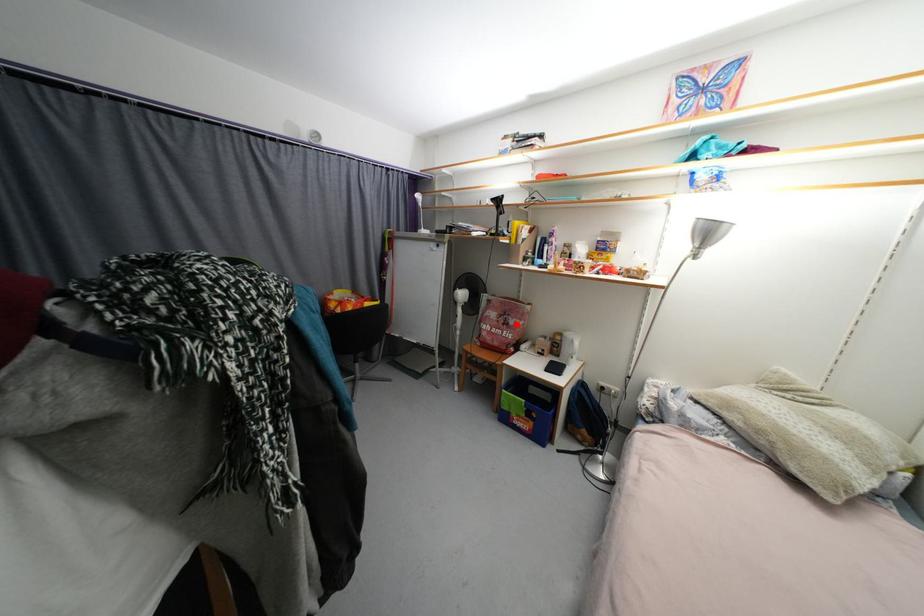
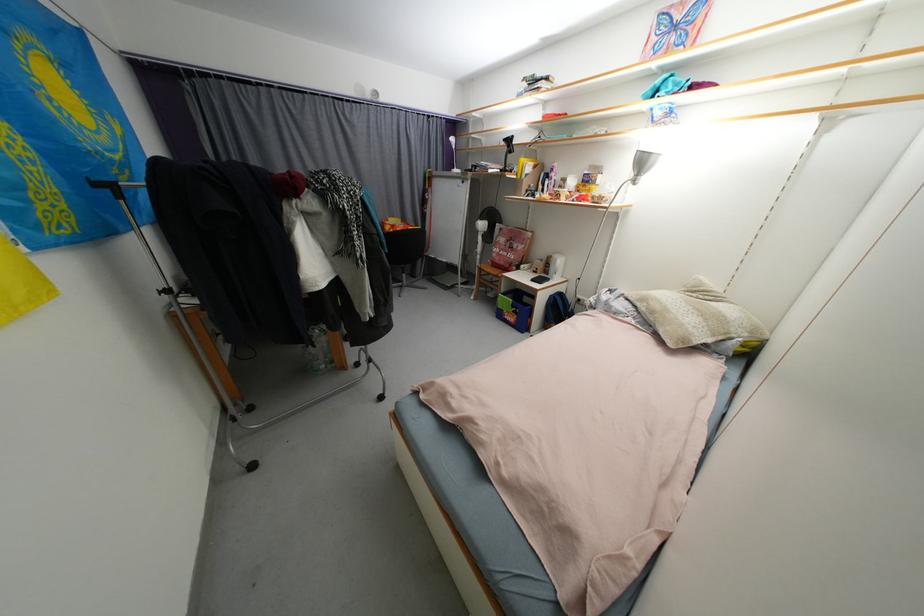
Question: A red point is marked in image1. In image2, is the corresponding 3D point closer to the camera or farther? Reply with the corresponding letter.

Choices:
 (A) The corresponding 3D point is closer.
 (B) The corresponding 3D point is farther.

Answer: (A)